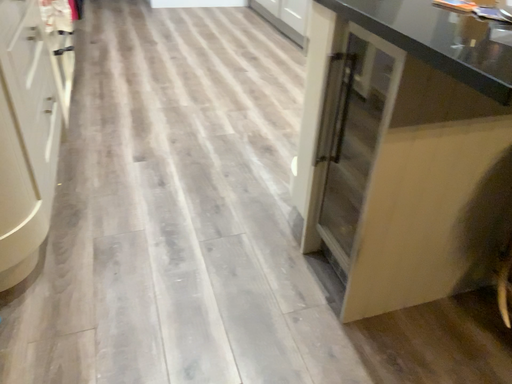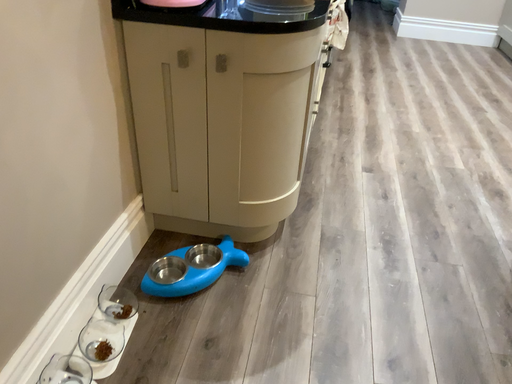
Question: Which way did the camera rotate in the video?

Choices:
 (A) rotated downward
 (B) rotated upward

Answer: (B)